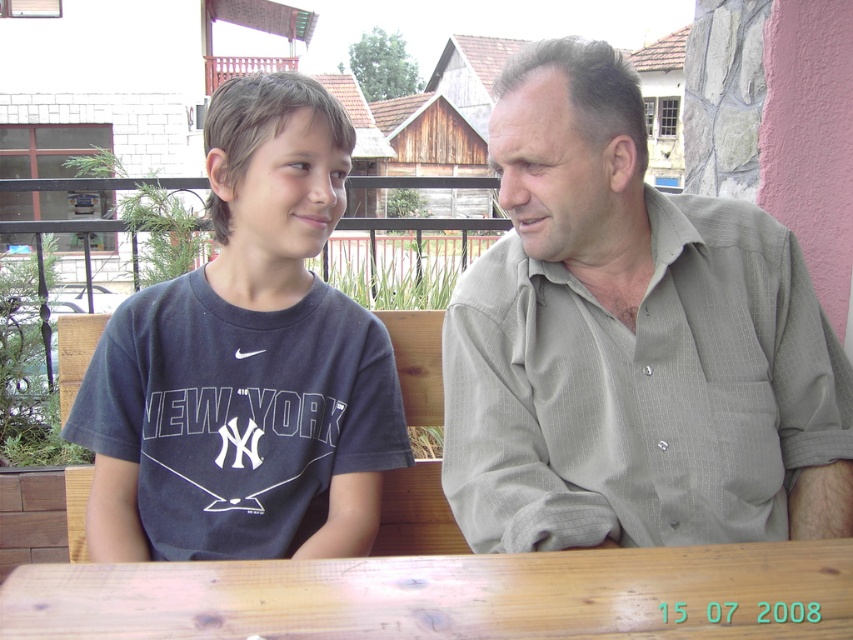
Question: In this image, where is gray textured shirt at upper right located relative to dark blue t-shirt at left?

Choices:
 (A) right
 (B) left

Answer: (A)

Question: Is gray textured shirt at upper right further to camera compared to wooden table at center?

Choices:
 (A) yes
 (B) no

Answer: (A)

Question: Considering the real-world distances, which object is farthest from the gray textured shirt at upper right?

Choices:
 (A) dark blue t-shirt at left
 (B) wooden table at center

Answer: (A)

Question: Among these points, which one is farthest from the camera?

Choices:
 (A) (569, 528)
 (B) (221, 548)
 (C) (714, 552)

Answer: (B)

Question: Is gray textured shirt at upper right closer to camera compared to wooden table at center?

Choices:
 (A) yes
 (B) no

Answer: (B)

Question: Which is farther from the gray textured shirt at upper right?

Choices:
 (A) wooden table at center
 (B) dark blue t-shirt at left

Answer: (B)